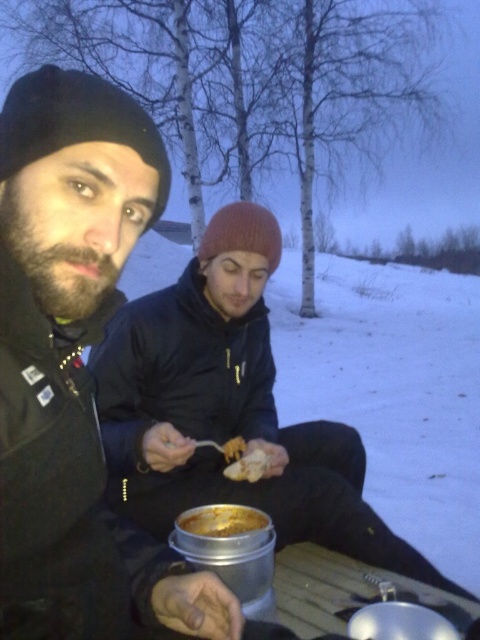
Is point (201, 516) farther from viewer compared to point (260, 467)?

No, it is in front of (260, 467).

Is golden brown crusty bread at center positioned in front of white crumbly bread at center?

Yes.

Find the location of a particular element. Image resolution: width=480 pixels, height=640 pixels. golden brown crusty bread at center is located at coordinates (222, 520).